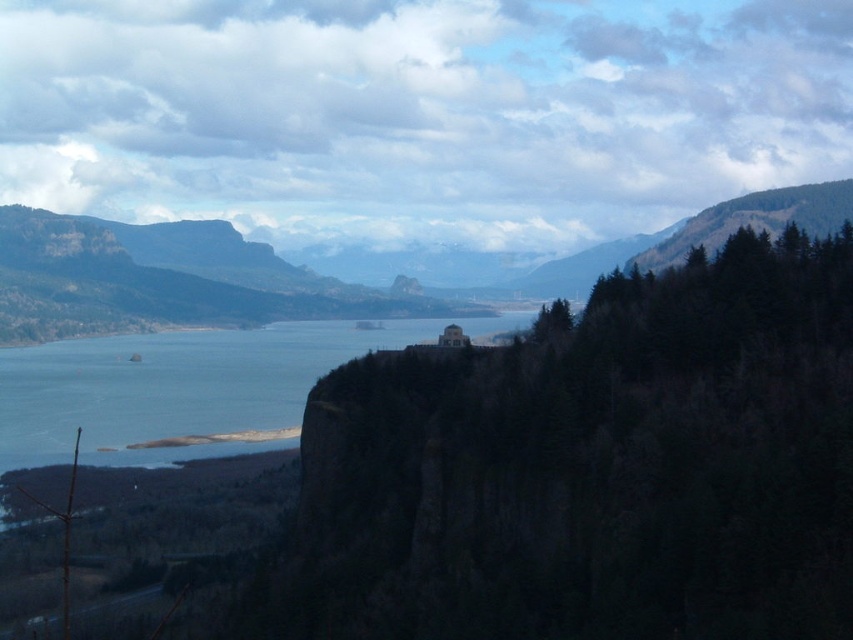
You are a hiker standing at the edge of the dark brown rocky cliff at center. You want to reach the lookout point located at coordinates point 0.731, 0.702. Is the lookout point located on the cliff or below it?

The lookout point is located on the dark brown rocky cliff at center since its coordinates match the cliff position.

You are standing at the cliff edge looking out over the water. There are two points marked on the image. Which point, point (332,509) or point (286,401), is closer to your current position?

Point (332,509) is closer to the camera than point (286,401), so it is closer to your current position at the cliff edge.